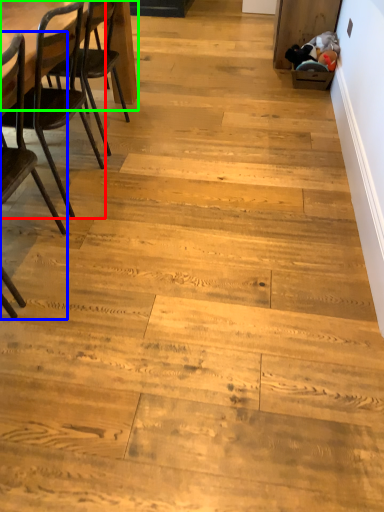
Question: Considering the real-world distances, which object is closest to chair (highlighted by a red box)? chair (highlighted by a blue box) or table (highlighted by a green box).

Choices:
 (A) chair
 (B) table

Answer: (A)